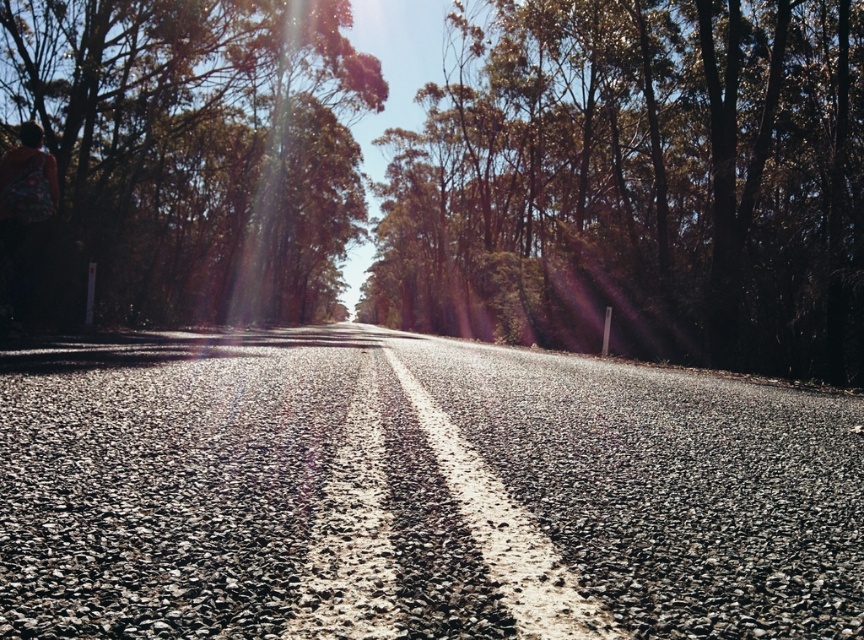
Based on the photo, you are driving along the road and see a point marked on the map at coordinates (638, 182). What is located at that point?

The point at (638, 182) marks green leafy trees at center.

You are driving along the road and see the green leafy trees at center and the green leafy tree at left. Which one is positioned more to the right side of the road?

The green leafy trees at center is positioned more to the right side of the road than the green leafy tree at left.

You are standing on the road and looking towards the distant trees. Which of the two trees, the green leafy trees at center or the green leafy tree at left, appears closer to you?

The green leafy tree at left appears closer because it is positioned below the green leafy trees at center, indicating it is nearer to the observer.